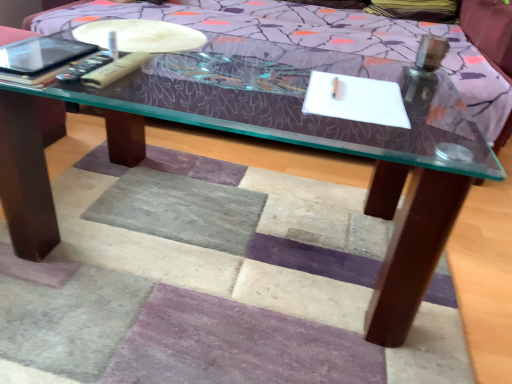
Image resolution: width=512 pixels, height=384 pixels. Describe the element at coordinates (141, 35) in the screenshot. I see `matte plastic remote control at upper left` at that location.

What do you see at coordinates (41, 55) in the screenshot? I see `matte black tablet at upper left` at bounding box center [41, 55].

At what (x,y) coordinates should I click in order to perform the action: click on matte plastic remote control at upper left. Please return your answer as a coordinate pair (x, y). The height and width of the screenshot is (384, 512). Looking at the image, I should click on (141, 35).

Can you confirm if black plastic remote at left, placed as the second remote when sorted from right to left, is positioned to the right of matte plastic remote control at upper left?

In fact, black plastic remote at left, placed as the second remote when sorted from right to left, is to the left of matte plastic remote control at upper left.

From the image's perspective, which one is positioned higher, black plastic remote at left, placed as the second remote when sorted from right to left, or matte plastic remote control at upper left?

matte plastic remote control at upper left appears higher in the image.

How many degrees apart are the facing directions of black plastic remote at left, which ranks as the 1th remote in left-to-right order, and matte plastic remote control at upper left?

They differ by 2.3 degrees in their facing directions.

Does point (87, 64) come behind point (143, 35)?

No.

Is beige plastic remote at upper left, which appears as the second remote when viewed from the left, oriented towards matte black tablet at upper left?

No, beige plastic remote at upper left, which appears as the second remote when viewed from the left, is not turned towards matte black tablet at upper left.

How many degrees apart are the facing directions of beige plastic remote at upper left, the first remote from the right, and matte black tablet at upper left?

0.00027 degrees separate the facing orientations of beige plastic remote at upper left, the first remote from the right, and matte black tablet at upper left.

Is the surface of beige plastic remote at upper left, which appears as the second remote when viewed from the left, in direct contact with matte black tablet at upper left?

beige plastic remote at upper left, which appears as the second remote when viewed from the left, is not next to matte black tablet at upper left, and they're not touching.

Does beige plastic remote at upper left, the first remote from the right, come in front of matte black tablet at upper left?

No, beige plastic remote at upper left, the first remote from the right, is further to the viewer.

From the picture: Who is shorter, matte plastic remote control at upper left or beige plastic remote at upper left, which appears as the second remote when viewed from the left?

With less height is matte plastic remote control at upper left.

Between point (169, 35) and point (118, 70), which one is positioned behind?

The point (169, 35) is behind.

Considering the sizes of objects matte plastic remote control at upper left and beige plastic remote at upper left, which appears as the second remote when viewed from the left, in the image provided, who is thinner, matte plastic remote control at upper left or beige plastic remote at upper left, which appears as the second remote when viewed from the left,?

beige plastic remote at upper left, which appears as the second remote when viewed from the left.

Does matte black tablet at upper left have a greater height compared to beige plastic remote at upper left, which appears as the second remote when viewed from the left?

No, matte black tablet at upper left is not taller than beige plastic remote at upper left, which appears as the second remote when viewed from the left.

Can you confirm if matte black tablet at upper left is positioned to the right of beige plastic remote at upper left, which appears as the second remote when viewed from the left?

Incorrect, matte black tablet at upper left is not on the right side of beige plastic remote at upper left, which appears as the second remote when viewed from the left.

Is matte black tablet at upper left in front of or behind beige plastic remote at upper left, the first remote from the right, in the image?

matte black tablet at upper left is positioned closer to the viewer than beige plastic remote at upper left, the first remote from the right.

Which point is more forward, (22, 75) or (121, 74)?

The point (22, 75) is in front.

Is matte black tablet at upper left positioned before black plastic remote at left, placed as the second remote when sorted from right to left?

Yes, matte black tablet at upper left is closer to the camera.

Which is closer to the camera, (69,57) or (85,73)?

The point (85,73) is closer.

Can you confirm if matte black tablet at upper left is smaller than black plastic remote at left, placed as the second remote when sorted from right to left?

No, matte black tablet at upper left is not smaller than black plastic remote at left, placed as the second remote when sorted from right to left.

From the image's perspective, which one is positioned lower, matte black tablet at upper left or black plastic remote at left, placed as the second remote when sorted from right to left?

black plastic remote at left, placed as the second remote when sorted from right to left, is shown below in the image.

In the scene shown: Is matte plastic remote control at upper left oriented towards black plastic remote at left, which ranks as the 1th remote in left-to-right order?

Yes, matte plastic remote control at upper left is oriented towards black plastic remote at left, which ranks as the 1th remote in left-to-right order.

The height and width of the screenshot is (384, 512). In order to click on round table that is behind the black plastic remote at left, which ranks as the 1th remote in left-to-right order in this screenshot , I will do `click(141, 35)`.

Which is farther, [168,44] or [94,67]?

The point [168,44] is behind.

Considering the relative sizes of matte black tablet at upper left and matte plastic remote control at upper left in the image provided, is matte black tablet at upper left taller than matte plastic remote control at upper left?

Indeed, matte black tablet at upper left has a greater height compared to matte plastic remote control at upper left.

Would you say matte black tablet at upper left is to the left or to the right of matte plastic remote control at upper left in the picture?

matte black tablet at upper left is positioned on matte plastic remote control at upper left's left side.

Where is `tablet computer on the left of matte plastic remote control at upper left`? Image resolution: width=512 pixels, height=384 pixels. tablet computer on the left of matte plastic remote control at upper left is located at coordinates (41, 55).

From the image's perspective, which one is positioned higher, matte black tablet at upper left or matte plastic remote control at upper left?

From the image's view, matte plastic remote control at upper left is above.

Identify the location of round table on the right of black plastic remote at left, placed as the second remote when sorted from right to left. The image size is (512, 384). (141, 35).

You are a GUI agent. You are given a task and a screenshot of the screen. Output one action in this format:
    pyautogui.click(x=<x>, y=<y>)
    Task: Click on the tablet computer above the beige plastic remote at upper left, the first remote from the right (from the image's perspective)
    
    Given the screenshot: What is the action you would take?
    pyautogui.click(x=41, y=55)

Looking at the image, which one is located closer to beige plastic remote at upper left, the first remote from the right, black plastic remote at left, which ranks as the 1th remote in left-to-right order, or matte black tablet at upper left?

black plastic remote at left, which ranks as the 1th remote in left-to-right order, lies closer to beige plastic remote at upper left, the first remote from the right, than the other object.

Estimate the real-world distances between objects in this image. Which object is closer to matte black tablet at upper left, black plastic remote at left, which ranks as the 1th remote in left-to-right order, or matte plastic remote control at upper left?

black plastic remote at left, which ranks as the 1th remote in left-to-right order, is closer to matte black tablet at upper left.

Based on their spatial positions, is matte plastic remote control at upper left or beige plastic remote at upper left, the first remote from the right, further from matte black tablet at upper left?

Based on the image, matte plastic remote control at upper left appears to be further to matte black tablet at upper left.

Which object lies further to the anchor point beige plastic remote at upper left, the first remote from the right, matte black tablet at upper left or matte plastic remote control at upper left?

matte plastic remote control at upper left lies further to beige plastic remote at upper left, the first remote from the right, than the other object.

Looking at the image, which one is located closer to matte black tablet at upper left, matte plastic remote control at upper left or black plastic remote at left, which ranks as the 1th remote in left-to-right order?

Based on the image, black plastic remote at left, which ranks as the 1th remote in left-to-right order, appears to be nearer to matte black tablet at upper left.

Considering their positions, is black plastic remote at left, placed as the second remote when sorted from right to left, positioned further to matte plastic remote control at upper left than matte black tablet at upper left?

black plastic remote at left, placed as the second remote when sorted from right to left, lies further to matte plastic remote control at upper left than the other object.

Based on their spatial positions, is matte plastic remote control at upper left or matte black tablet at upper left closer to black plastic remote at left, placed as the second remote when sorted from right to left?

matte black tablet at upper left.

Estimate the real-world distances between objects in this image. Which object is closer to matte plastic remote control at upper left, matte black tablet at upper left or black plastic remote at left, which ranks as the 1th remote in left-to-right order?

Based on the image, matte black tablet at upper left appears to be nearer to matte plastic remote control at upper left.

The height and width of the screenshot is (384, 512). I want to click on remote positioned between black plastic remote at left, placed as the second remote when sorted from right to left, and matte plastic remote control at upper left from near to far, so click(x=115, y=70).

The image size is (512, 384). Identify the location of remote between matte black tablet at upper left and beige plastic remote at upper left, the first remote from the right, in the horizontal direction. (86, 66).